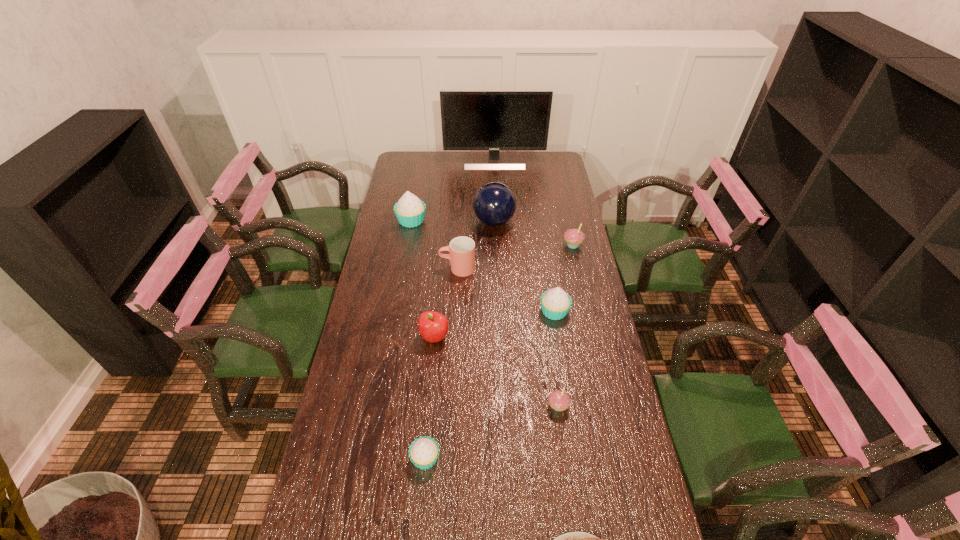
Where is `object located at the far edge`? Image resolution: width=960 pixels, height=540 pixels. object located at the far edge is located at coordinates (493, 120).

Where is `object located at the left edge`? The image size is (960, 540). object located at the left edge is located at coordinates (410, 210).

Where is `monitor that is at the right edge`? The image size is (960, 540). monitor that is at the right edge is located at coordinates (493, 120).

You are a GUI agent. You are given a task and a screenshot of the screen. Output one action in this format:
    pyautogui.click(x=<x>, y=<y>)
    Task: Click on the object present at the far right corner
    The height and width of the screenshot is (540, 960).
    Given the screenshot: What is the action you would take?
    pyautogui.click(x=493, y=120)

Where is `vacant space at the far edge of the desktop`? This screenshot has height=540, width=960. vacant space at the far edge of the desktop is located at coordinates (520, 153).

Where is `vacant space at the left edge`? vacant space at the left edge is located at coordinates coord(338,396).

Locate an element on the screen. This screenshot has height=540, width=960. vacant space at the right edge is located at coordinates (590, 314).

The image size is (960, 540). In order to click on free region at the far right corner of the desktop in this screenshot , I will do click(x=560, y=152).

You are a GUI agent. You are given a task and a screenshot of the screen. Output one action in this format:
    pyautogui.click(x=<x>, y=<y>)
    Task: Click on the vacant space in between the ninth shortest object and the leftmost cupcake
    The width and height of the screenshot is (960, 540).
    Given the screenshot: What is the action you would take?
    pyautogui.click(x=453, y=221)

Find the location of `free space between the left pink cupcake and the apple`. free space between the left pink cupcake and the apple is located at coordinates (496, 372).